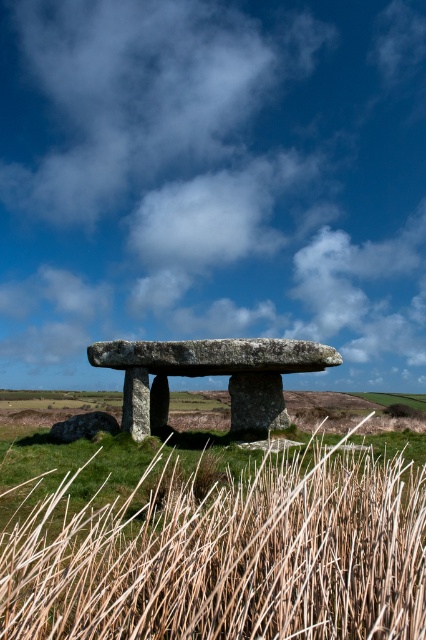
You are an archaeologist standing in the field looking at the scene. Which object is closer to you, the white fluffy cloud at upper center or the rough stone dolmen at center?

The white fluffy cloud at upper center is closer to you because the rough stone dolmen at center is behind it.

You are an archaeologist examining the prehistoric dolmen. You notice a white fluffy cloud at upper center and a rough stone dolmen at center. Which object is bigger in size?

The white fluffy cloud at upper center has a larger size compared to the rough stone dolmen at center.

Based on the photo, you are an archaeologist examining the dolmen. You notice the white fluffy cloud at upper center and the brown textured reed at lower left. Which object is closer to you?

The brown textured reed at lower left is behind the white fluffy cloud at upper center, so the white fluffy cloud at upper center is closer to you.